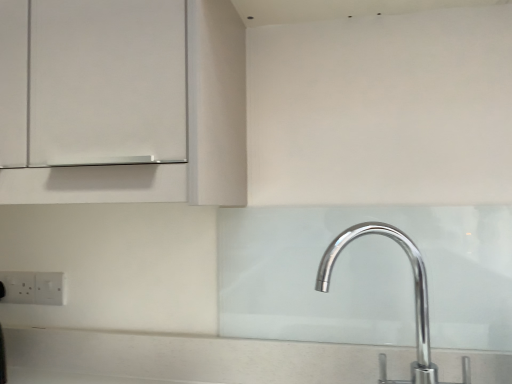
Question: Is white plastic electric outlet at lower left, marked as the 2th electric outlet in a right-to-left arrangement, aimed at white plastic electric outlet at lower left, which ranks as the first electric outlet in right-to-left order?

Choices:
 (A) yes
 (B) no

Answer: (B)

Question: From a real-world perspective, does white plastic electric outlet at lower left, marked as the first electric outlet in a left-to-right arrangement, stand above white plastic electric outlet at lower left, which ranks as the first electric outlet in right-to-left order?

Choices:
 (A) yes
 (B) no

Answer: (B)

Question: Is white plastic electric outlet at lower left, marked as the 2th electric outlet in a right-to-left arrangement, taller than white plastic electric outlet at lower left, which ranks as the first electric outlet in right-to-left order?

Choices:
 (A) yes
 (B) no

Answer: (A)

Question: Would you consider white plastic electric outlet at lower left, marked as the 2th electric outlet in a right-to-left arrangement, to be distant from white plastic electric outlet at lower left, which ranks as the first electric outlet in right-to-left order?

Choices:
 (A) no
 (B) yes

Answer: (A)

Question: Is white plastic electric outlet at lower left, marked as the first electric outlet in a left-to-right arrangement, thinner than white plastic electric outlet at lower left, acting as the second electric outlet starting from the left?

Choices:
 (A) no
 (B) yes

Answer: (A)

Question: From a real-world perspective, is white plastic electric outlet at lower left, which ranks as the first electric outlet in right-to-left order, physically located above or below white plastic electric outlet at lower left, marked as the first electric outlet in a left-to-right arrangement?

Choices:
 (A) above
 (B) below

Answer: (A)

Question: In terms of height, does white plastic electric outlet at lower left, acting as the second electric outlet starting from the left, look taller or shorter compared to white plastic electric outlet at lower left, marked as the first electric outlet in a left-to-right arrangement?

Choices:
 (A) tall
 (B) short

Answer: (B)

Question: Is white plastic electric outlet at lower left, acting as the second electric outlet starting from the left, situated inside white plastic electric outlet at lower left, marked as the 2th electric outlet in a right-to-left arrangement, or outside?

Choices:
 (A) outside
 (B) inside

Answer: (A)

Question: Visually, is white plastic electric outlet at lower left, acting as the second electric outlet starting from the left, positioned to the left or to the right of white plastic electric outlet at lower left, marked as the first electric outlet in a left-to-right arrangement?

Choices:
 (A) right
 (B) left

Answer: (A)

Question: Relative to polished chrome tap at lower right, is white plastic electric outlet at lower left, marked as the first electric outlet in a left-to-right arrangement, in front or behind?

Choices:
 (A) front
 (B) behind

Answer: (B)

Question: Based on their sizes in the image, would you say white plastic electric outlet at lower left, marked as the first electric outlet in a left-to-right arrangement, is bigger or smaller than polished chrome tap at lower right?

Choices:
 (A) big
 (B) small

Answer: (B)

Question: Is white plastic electric outlet at lower left, marked as the 2th electric outlet in a right-to-left arrangement, to the left or to the right of polished chrome tap at lower right in the image?

Choices:
 (A) left
 (B) right

Answer: (A)

Question: From the image's perspective, relative to polished chrome tap at lower right, is white plastic electric outlet at lower left, marked as the first electric outlet in a left-to-right arrangement, above or below?

Choices:
 (A) below
 (B) above

Answer: (A)

Question: Looking at the image, does white plastic electric outlet at lower left, which ranks as the first electric outlet in right-to-left order, seem bigger or smaller compared to polished chrome tap at lower right?

Choices:
 (A) big
 (B) small

Answer: (B)

Question: Considering the positions of white plastic electric outlet at lower left, which ranks as the first electric outlet in right-to-left order, and polished chrome tap at lower right in the image, is white plastic electric outlet at lower left, which ranks as the first electric outlet in right-to-left order, wider or thinner than polished chrome tap at lower right?

Choices:
 (A) thin
 (B) wide

Answer: (A)